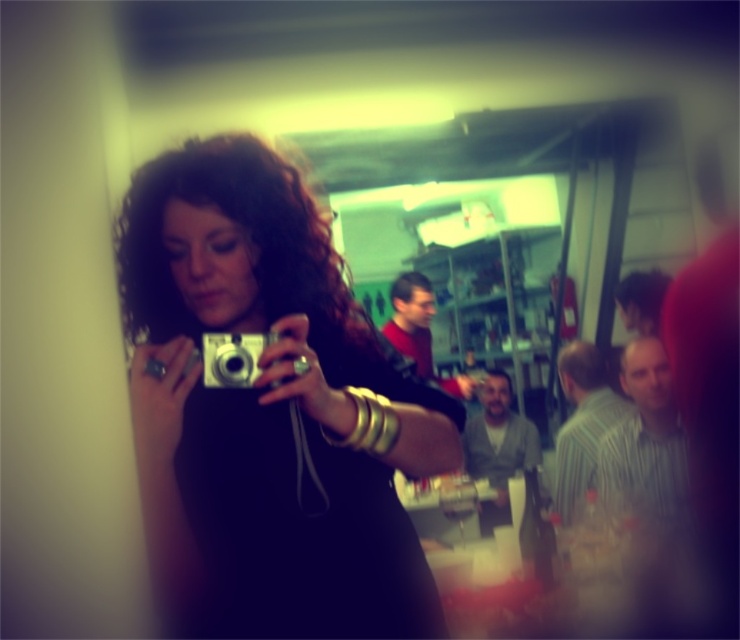
Between matte black dress at center and silver metallic camera at center, which one appears on the left side from the viewer's perspective?

silver metallic camera at center is more to the left.

Is matte black dress at center below silver metallic camera at center?

Yes.

Does point (255, 186) come behind point (252, 333)?

That is True.

At what (x,y) coordinates should I click in order to perform the action: click on matte black dress at center. Please return your answer as a coordinate pair (x, y). The image size is (740, 640). Looking at the image, I should click on (269, 412).